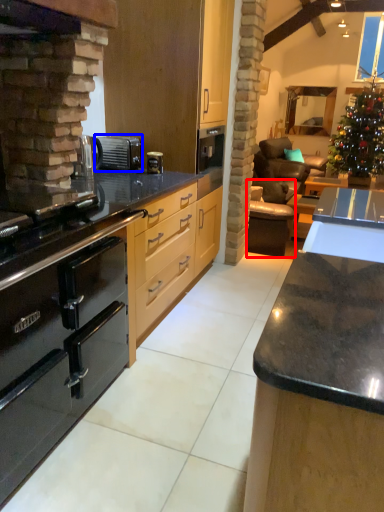
Question: Which of the following is the farthest to the observer, armchair (highlighted by a red box) or appliance (highlighted by a blue box)?

Choices:
 (A) armchair
 (B) appliance

Answer: (A)